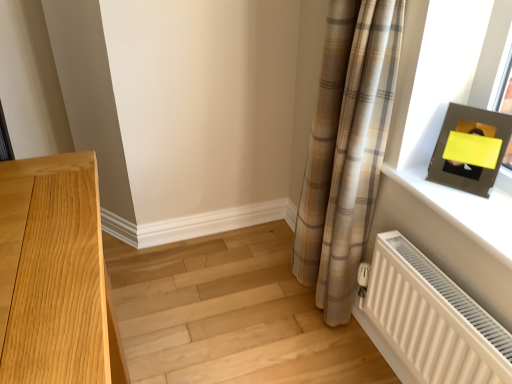
You are a GUI agent. You are given a task and a screenshot of the screen. Output one action in this format:
    pyautogui.click(x=<x>, y=<y>)
    Task: Click on the vacant space situated on the left part of plaid fabric curtain at right
    This screenshot has height=384, width=512.
    Given the screenshot: What is the action you would take?
    pyautogui.click(x=259, y=301)